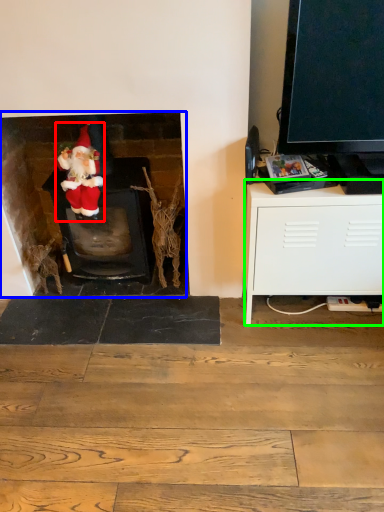
Question: Which is nearer to the person (highlighted by a red box)? fireplace (highlighted by a blue box) or cabinetry (highlighted by a green box).

Choices:
 (A) fireplace
 (B) cabinetry

Answer: (A)